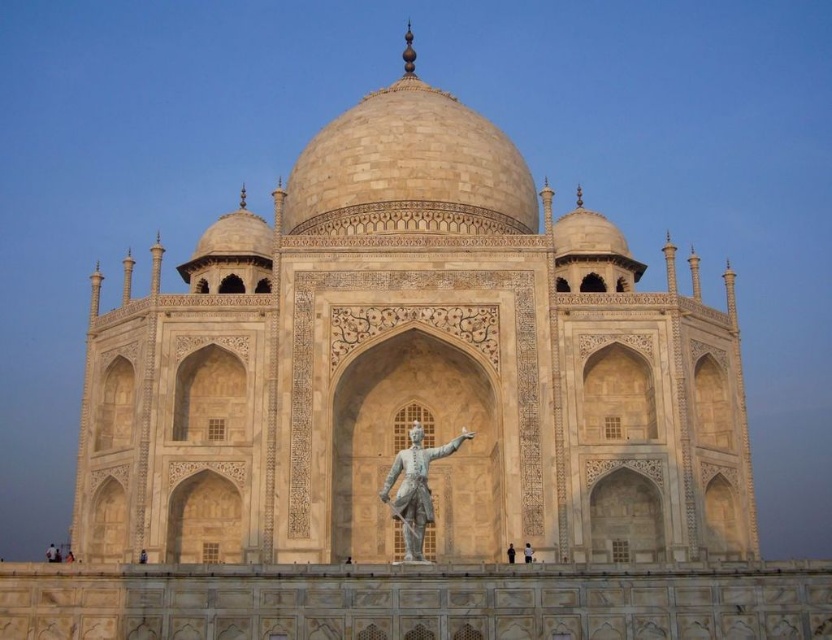
You are an art curator planning to display both the polished bronze statue at center and the smooth white statue at center in an exhibition. Given their widths, which statue would require more horizontal space for proper display?

The polished bronze statue at center requires more horizontal space because its width surpasses that of the smooth white statue at center.

You are a tourist visiting the Taj Mahal and want to take a photo that includes both the beige stone taj mahal at center and the black statue at center. Which object should you position closer to the camera to ensure both are fully visible in the frame?

You should position the black statue at center closer to the camera because the beige stone taj mahal at center is much taller, so placing the shorter black statue at center nearer will help balance their sizes in the photo.

You are an art curator planning to display both the dark brown wooden statue at center and the black statue at center in a gallery. Given their sizes, which statue would require a wider base to prevent tipping over?

The dark brown wooden statue at center requires a wider base because its width is larger than the black statue at center, making it potentially less stable without proper support.